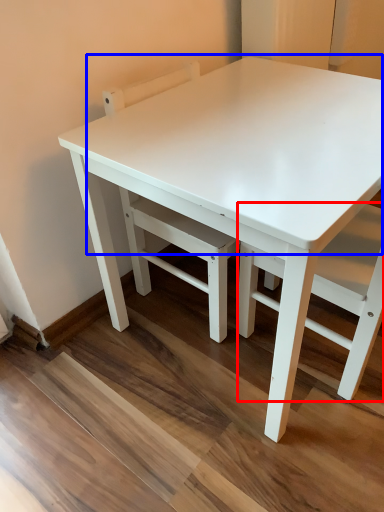
Question: Which of the following is the closest to the observer, chair (highlighted by a red box) or table top (highlighted by a blue box)?

Choices:
 (A) chair
 (B) table top

Answer: (A)